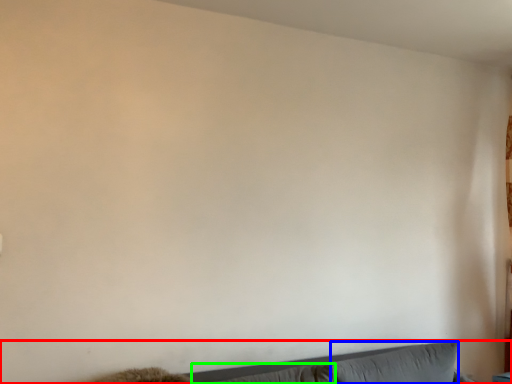
Question: Estimate the real-world distances between objects in this image. Which object is farther from couch (highlighted by a red box), pillow (highlighted by a blue box) or pillow (highlighted by a green box)?

Choices:
 (A) pillow
 (B) pillow

Answer: (A)